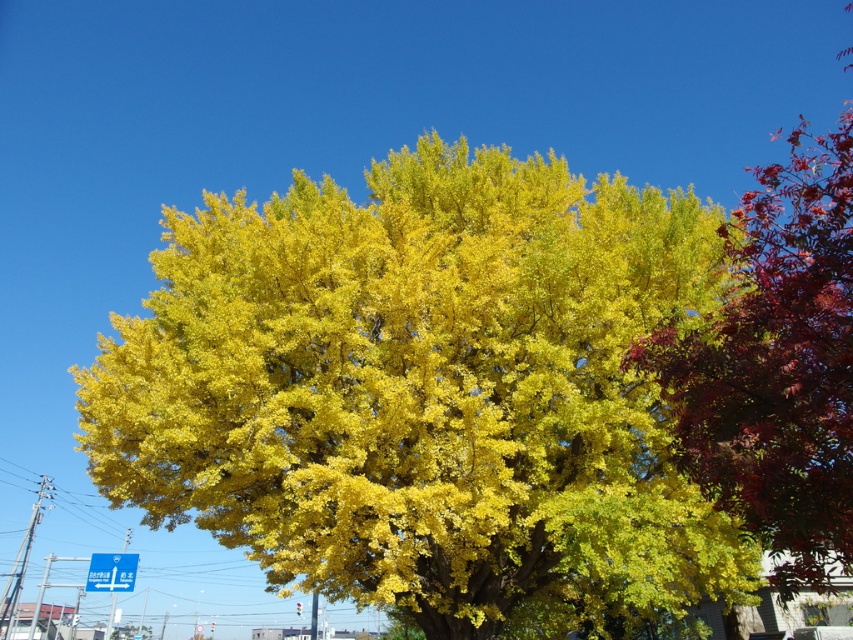
Who is taller, golden yellow leaves at center or shiny red leaves at upper right?

shiny red leaves at upper right

This screenshot has width=853, height=640. What do you see at coordinates (422, 392) in the screenshot?
I see `golden yellow leaves at center` at bounding box center [422, 392].

Locate an element on the screen. golden yellow leaves at center is located at coordinates (422, 392).